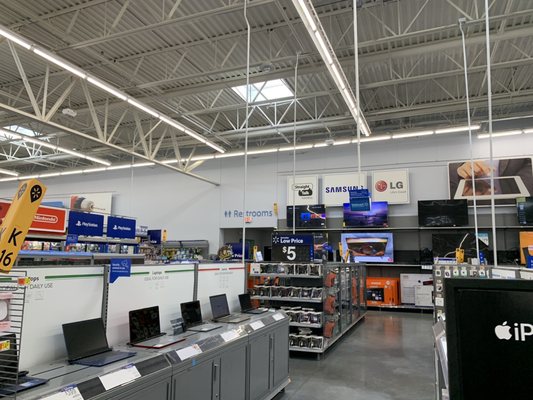
What are the coordinates of `metal display shelf` in the screenshot? It's located at (406, 307).